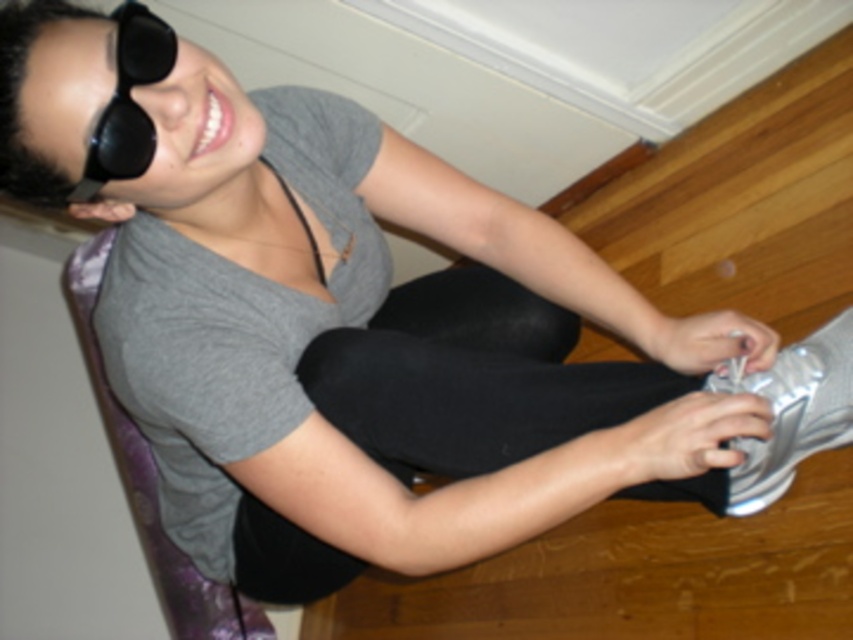
Question: Among these points, which one is nearest to the camera?

Choices:
 (A) (339, 108)
 (B) (743, 380)
 (C) (149, 28)
 (D) (648, 362)

Answer: (C)

Question: Estimate the real-world distances between objects in this image. Which object is closer to the black matte sunglasses at upper left?

Choices:
 (A) black matte leggings at center
 (B) matte gray shirt at upper left

Answer: (B)

Question: Does black matte leggings at center appear on the right side of black matte sunglasses at upper left?

Choices:
 (A) yes
 (B) no

Answer: (A)

Question: Which point is closer to the camera taking this photo?

Choices:
 (A) (738, 371)
 (B) (450, 339)

Answer: (A)

Question: Can you confirm if matte gray shirt at upper left is positioned above black matte sunglasses at upper left?

Choices:
 (A) yes
 (B) no

Answer: (B)

Question: Does silver metallic shoe at lower right lie behind black matte sunglasses at upper left?

Choices:
 (A) no
 (B) yes

Answer: (B)